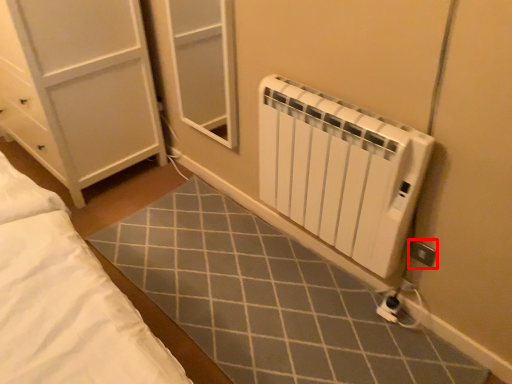
Question: Where is electric outlet (annotated by the red box) located in relation to radiator in the image?

Choices:
 (A) right
 (B) left

Answer: (A)